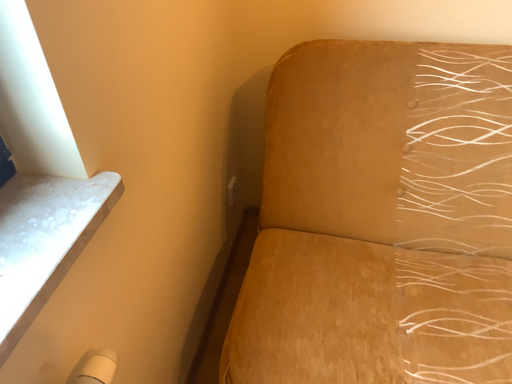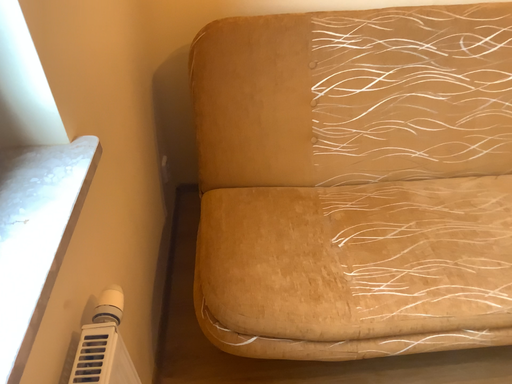
Question: How did the camera likely rotate when shooting the video?

Choices:
 (A) rotated right
 (B) rotated left

Answer: (A)